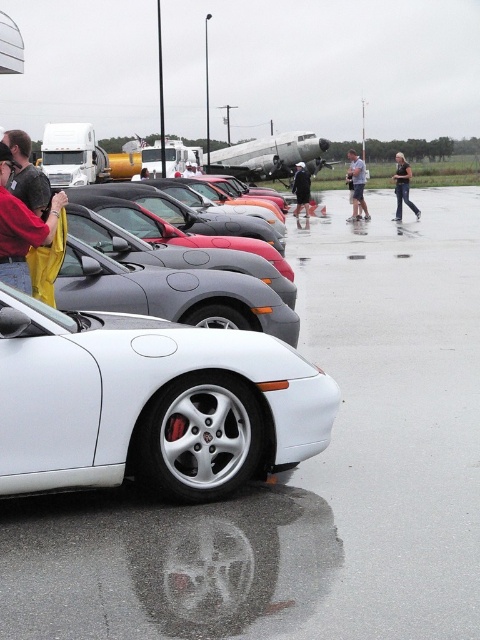
Based on the photo, who is more forward, [205,202] or [397,179]?

Point [205,202] is more forward.

Is point (245, 225) in front of point (408, 193)?

Yes, it is in front of point (408, 193).

Who is more forward, [225,211] or [407,193]?

Point [225,211] is more forward.

The width and height of the screenshot is (480, 640). I want to click on shiny metallic car at center, so click(219, 208).

Based on the photo, can you confirm if shiny black car at center is taller than dark gray shirt at left?

Correct, shiny black car at center is much taller as dark gray shirt at left.

Is point (201, 212) positioned behind point (33, 179)?

Yes, point (201, 212) is behind point (33, 179).

Image resolution: width=480 pixels, height=640 pixels. I want to click on shiny black car at center, so click(189, 211).

The width and height of the screenshot is (480, 640). What do you see at coordinates (21, 227) in the screenshot? I see `yellow fabric at left` at bounding box center [21, 227].

Can you confirm if yellow fabric at left is positioned below dark blue jacket at center?

Yes, yellow fabric at left is below dark blue jacket at center.

Is point (55, 227) less distant than point (302, 195)?

Yes, it is in front of point (302, 195).

The image size is (480, 640). What are the coordinates of `yellow fabric at left` in the screenshot? It's located at (21, 227).